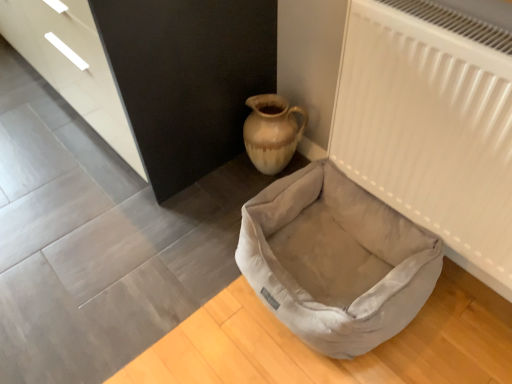
Question: From the image's perspective, is matte black dresser at upper left located above or below velvet beige dog bed at lower center?

Choices:
 (A) below
 (B) above

Answer: (B)

Question: In the image, is matte black dresser at upper left positioned in front of or behind velvet beige dog bed at lower center?

Choices:
 (A) behind
 (B) front

Answer: (A)

Question: Considering the real-world distances, which object is closest to the white matte radiator at upper right?

Choices:
 (A) velvet beige dog bed at lower center
 (B) matte beige ceramic vase at upper left
 (C) matte black dresser at upper left

Answer: (A)

Question: Based on their relative distances, which object is nearer to the velvet beige dog bed at lower center?

Choices:
 (A) white matte radiator at upper right
 (B) matte black dresser at upper left
 (C) matte beige ceramic vase at upper left

Answer: (A)